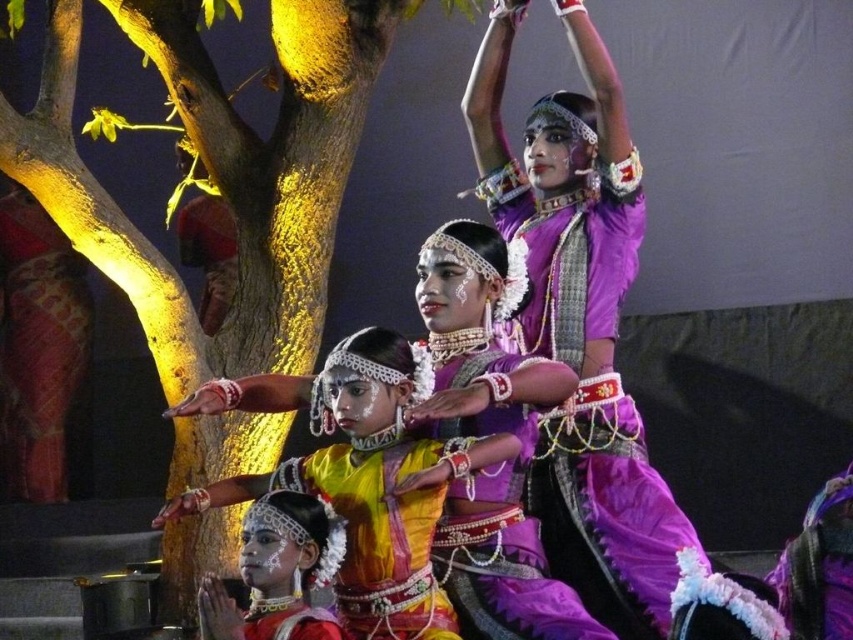
You are a photographer at the back of the stage and want to capture both the yellow satin saree at center and the purple satin saree at center in a single frame. Which dancer should you focus on first to ensure both are visible?

You should focus on the yellow satin saree at center first because it is in front of the purple satin saree at center, ensuring both will be visible when centered in the frame.

You are a photographer at the dance performance. You want to capture a photo where the purple satin saree at center and the textured red fabric at left are both visible. Which object will appear larger in the photo?

The purple satin saree at center will appear larger in the photo because it is closer to the viewer than the textured red fabric at left.

You are a photographer positioned at the origin of the coordinate system. You notice a point at coordinates point (373,490) in the image. Which object from the scene does this point correspond to?

The point (373,490) corresponds to the yellow satin saree at center.